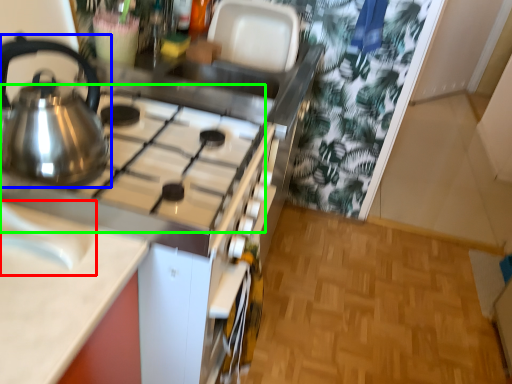
Question: Which object is positioned farthest from sink (highlighted by a red box)? Select from kettle (highlighted by a blue box) and gas stove (highlighted by a green box).

Choices:
 (A) kettle
 (B) gas stove

Answer: (B)